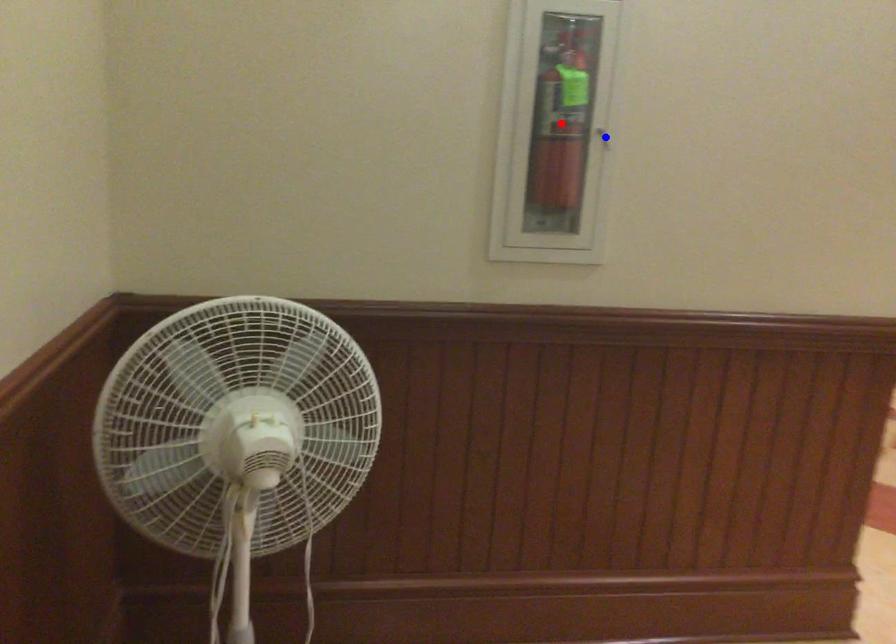
Question: In the image, two points are highlighted. Which point is nearer to the camera? Reply with the corresponding letter.

Choices:
 (A) blue point
 (B) red point

Answer: (B)